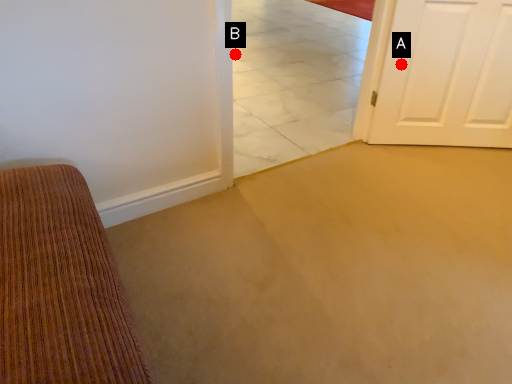
Question: Two points are circled on the image, labeled by A and B beside each circle. Which point is farther to the camera?

Choices:
 (A) A is further
 (B) B is further

Answer: (B)